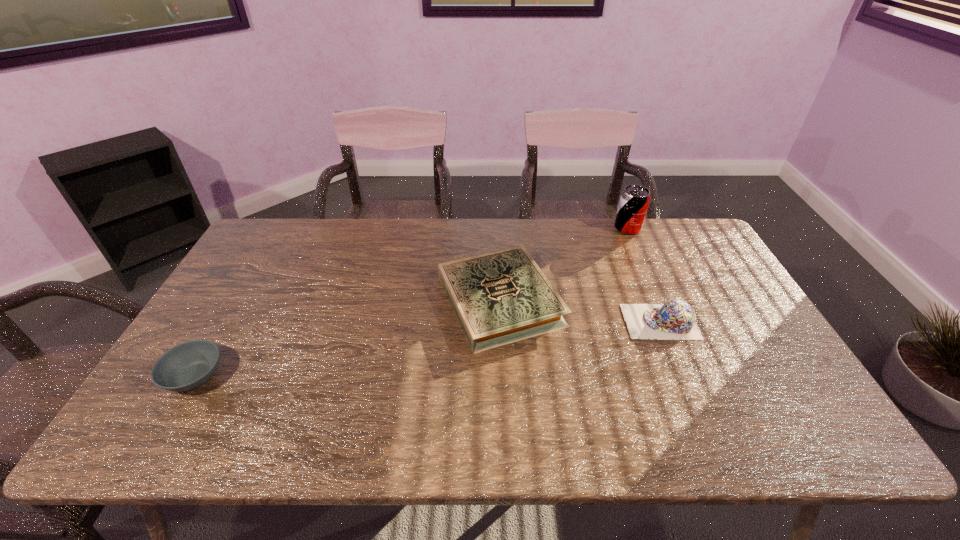
What are the coordinates of `vacant space that is in between the cap and the tallest object` in the screenshot? It's located at (644, 275).

Locate an element on the screen. This screenshot has height=540, width=960. blank region between the soup bowl and the third object from right to left is located at coordinates (348, 339).

The height and width of the screenshot is (540, 960). I want to click on unoccupied area between the cap and the hardback book, so click(x=580, y=312).

This screenshot has width=960, height=540. In order to click on vacant space that's between the hardback book and the farthest object in this screenshot , I will do `click(564, 265)`.

Where is `free space that is in between the cap and the tallest object`? Image resolution: width=960 pixels, height=540 pixels. free space that is in between the cap and the tallest object is located at coordinates (644, 275).

The width and height of the screenshot is (960, 540). I want to click on vacant region between the leftmost object and the third object from right to left, so click(x=348, y=339).

The image size is (960, 540). What are the coordinates of `vacant space in between the tallest object and the second object from left to right` in the screenshot? It's located at [564, 265].

This screenshot has width=960, height=540. I want to click on free spot between the soda can and the hardback book, so click(564, 265).

At what (x,y) coordinates should I click in order to perform the action: click on empty space between the third object from right to left and the cap. Please return your answer as a coordinate pair (x, y). This screenshot has width=960, height=540. Looking at the image, I should click on (580, 312).

The height and width of the screenshot is (540, 960). In order to click on object that stands as the closest to the leftmost object in this screenshot , I will do pos(501,297).